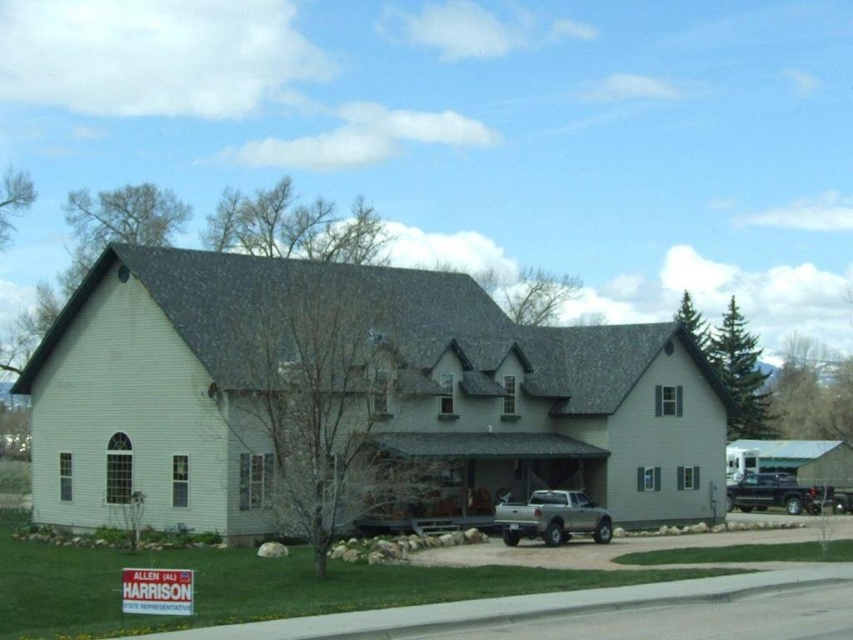
Between silver metallic truck at lower center and shiny black truck at lower right, which one appears on the left side from the viewer's perspective?

silver metallic truck at lower center

Is silver metallic truck at lower center smaller than shiny black truck at lower right?

Correct, silver metallic truck at lower center occupies less space than shiny black truck at lower right.

Find the location of a particular element. The height and width of the screenshot is (640, 853). silver metallic truck at lower center is located at coordinates (552, 516).